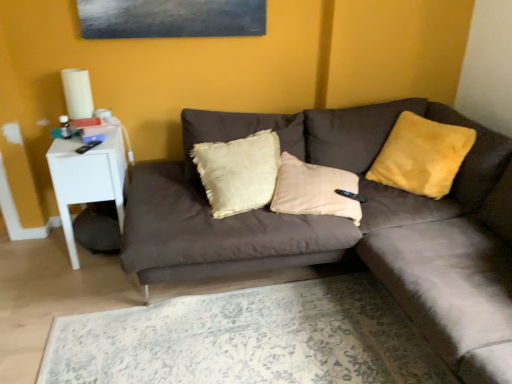
The height and width of the screenshot is (384, 512). Identify the location of free space in front of white glossy side table at left. (67, 286).